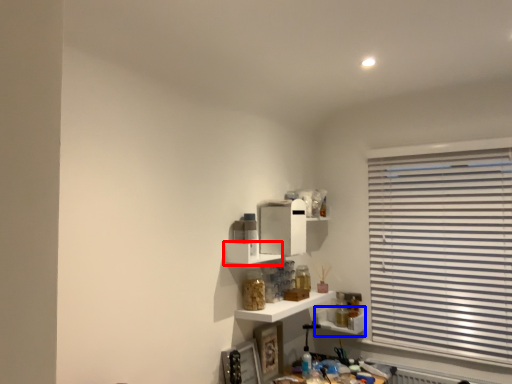
Question: Which of the following is the closest to the observer, shelf (highlighted by a red box) or shelf (highlighted by a blue box)?

Choices:
 (A) shelf
 (B) shelf

Answer: (A)